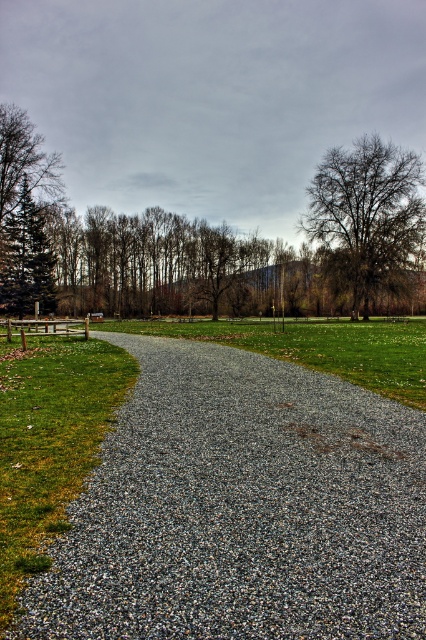
How distant is green grass at left from green matte tree at left?

A distance of 45.60 meters exists between green grass at left and green matte tree at left.

Find the location of a particular element. green grass at left is located at coordinates (49, 442).

Locate an element on the screen. The width and height of the screenshot is (426, 640). green grass at left is located at coordinates (49, 442).

What are the coordinates of `gray gravel path at center` in the screenshot? It's located at (241, 509).

Does gray gravel path at center appear on the left side of green matte tree at left?

No, gray gravel path at center is not to the left of green matte tree at left.

Who is more distant from viewer, (138, 557) or (40, 300)?

Point (40, 300)

Identify the location of gray gravel path at center. The image size is (426, 640). (241, 509).

Between gray gravel path at center and bare branches at upper right, which one is positioned lower?

gray gravel path at center is below.

Does gray gravel path at center appear on the left side of bare branches at upper right?

Correct, you'll find gray gravel path at center to the left of bare branches at upper right.

This screenshot has width=426, height=640. What do you see at coordinates (241, 509) in the screenshot? I see `gray gravel path at center` at bounding box center [241, 509].

The image size is (426, 640). I want to click on gray gravel path at center, so click(241, 509).